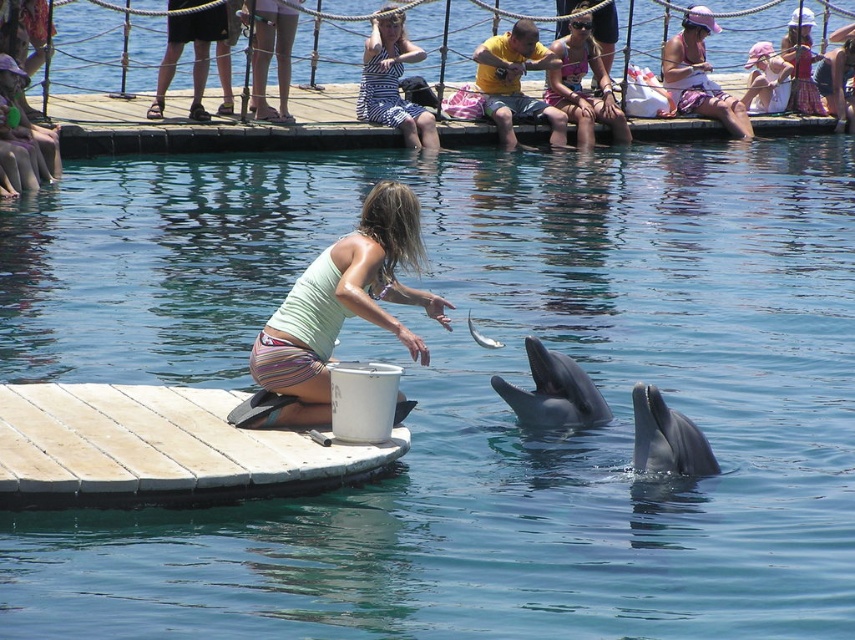
Find the location of a particular element. The width and height of the screenshot is (855, 640). white wood dock at center is located at coordinates (158, 449).

Between white wood dock at center and pink fabric at upper center, which one has more height?

white wood dock at center is taller.

Who is more forward, [21,384] or [675,80]?

Point [21,384] is more forward.

At what (x,y) coordinates should I click in order to perform the action: click on white wood dock at center. Please return your answer as a coordinate pair (x, y). The height and width of the screenshot is (640, 855). Looking at the image, I should click on (158, 449).

Is smooth gray dolphin at center shorter than gray smooth dolphin at lower center?

Incorrect, smooth gray dolphin at center's height does not fall short of gray smooth dolphin at lower center's.

Who is more forward, [537,424] or [705,458]?

Positioned in front is point [705,458].

Between point (541, 376) and point (658, 429), which one is positioned behind?

Positioned behind is point (541, 376).

The image size is (855, 640). What are the coordinates of `smooth gray dolphin at center` in the screenshot? It's located at (553, 392).

Is yellow matte shirt at upper center positioned behind gray smooth dolphin at lower center?

Yes.

Find the location of `yellow matte shirt at upper center`. yellow matte shirt at upper center is located at coordinates [x=516, y=81].